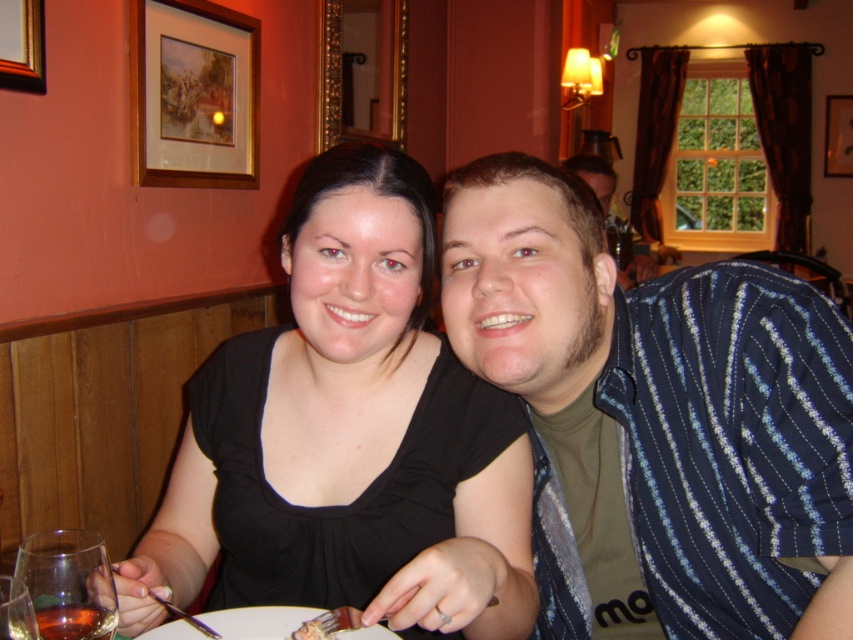
You are a waiter in a restaurant and need to place a 60 cm long tray of appetizers between the two people seated at the table. The tray must be placed exactly where the translucent glass wine at lower left is currently located. Can the tray fit in that space without overlapping the glass or the people?

The distance between the translucent glass wine at lower left and the viewer is 61.52 centimeters. Since the tray is 60 cm long, it can fit in the space as it is slightly shorter than the available distance. However, the question mentions placing it exactly where the glass is, so the tray might still overlap with the glass or the people unless moved aside. The answer should consider the exact placement and available space. Wait, the description only gives the distance from the viewer to the glass, not the 3

You are a server at the restaurant and need to place a new drink order. The customer has specified they want their drink in the glass that is positioned to the right. Which glass should you choose between the amber glass at lower left and the transparent glass at lower left?

The amber glass at lower left is positioned to the right of the transparent glass at lower left, so you should choose the amber glass at lower left for the drink order.